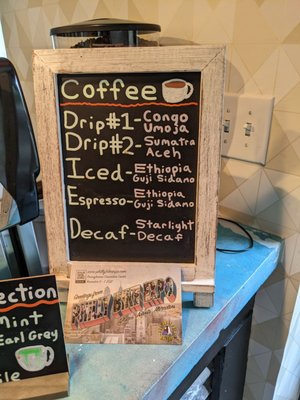
The height and width of the screenshot is (400, 300). Identify the location of black board. (141, 250).